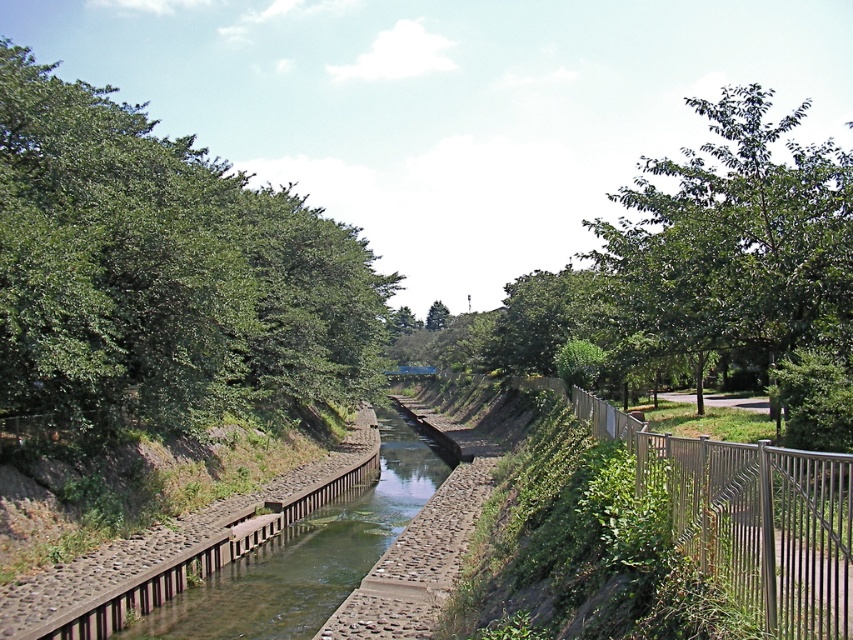
Does point (184, 342) come closer to viewer compared to point (733, 292)?

That is False.

Looking at this image, does green leafy tree at left have a lesser height compared to green leafy tree at upper right?

Indeed, green leafy tree at left has a lesser height compared to green leafy tree at upper right.

You are a GUI agent. You are given a task and a screenshot of the screen. Output one action in this format:
    pyautogui.click(x=<x>, y=<y>)
    Task: Click on the green leafy tree at left
    This screenshot has height=640, width=853.
    Given the screenshot: What is the action you would take?
    pyautogui.click(x=163, y=272)

I want to click on green leafy tree at left, so click(163, 272).

Does metallic silver fence at right have a lesser width compared to green leafy tree at center?

Indeed, metallic silver fence at right has a lesser width compared to green leafy tree at center.

Describe the element at coordinates (747, 515) in the screenshot. Image resolution: width=853 pixels, height=640 pixels. I see `metallic silver fence at right` at that location.

This screenshot has width=853, height=640. In order to click on metallic silver fence at right in this screenshot , I will do `click(747, 515)`.

Can you confirm if green leafy tree at left is shorter than green leafy tree at center?

Incorrect, green leafy tree at left's height does not fall short of green leafy tree at center's.

Is green leafy tree at left bigger than green leafy tree at center?

Correct, green leafy tree at left is larger in size than green leafy tree at center.

Does point (144, 282) come farther from viewer compared to point (445, 310)?

No.

Where is `green leafy tree at left`? The image size is (853, 640). green leafy tree at left is located at coordinates (163, 272).